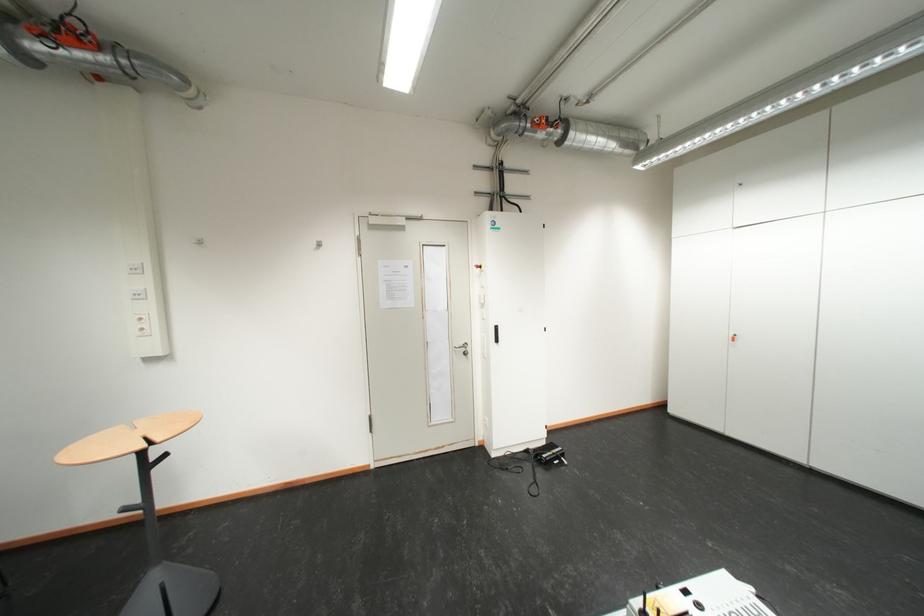
The height and width of the screenshot is (616, 924). Describe the element at coordinates (88, 54) in the screenshot. I see `the red valve handle` at that location.